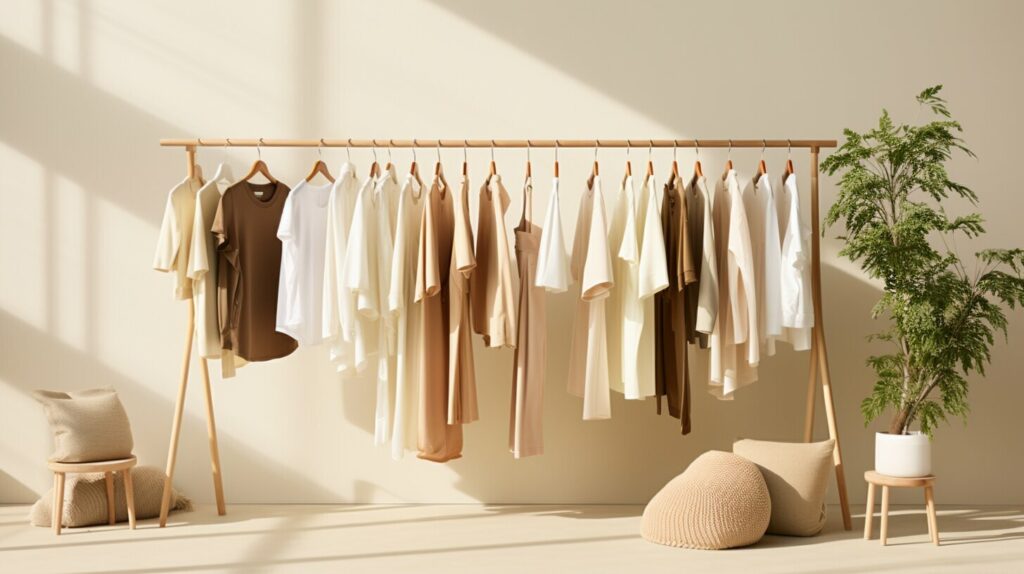
Where is `pillows`? This screenshot has height=574, width=1024. pillows is located at coordinates (84, 502), (93, 429), (733, 497), (779, 468).